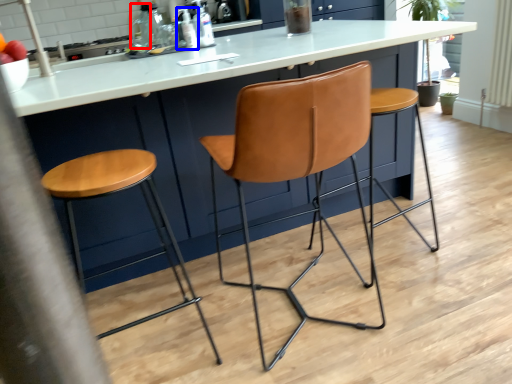
Question: Which of the following is the closest to the observer, bottle (highlighted by a red box) or bottle (highlighted by a blue box)?

Choices:
 (A) bottle
 (B) bottle

Answer: (B)